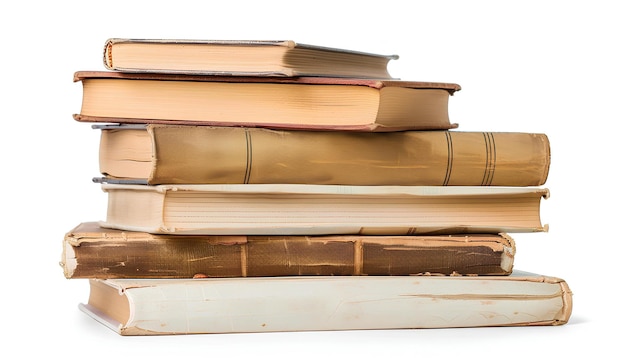
You are a GUI agent. You are given a task and a screenshot of the screen. Output one action in this format:
    pyautogui.click(x=<x>, y=<y>)
    Task: Click on the books
    This screenshot has height=358, width=626.
    Given the screenshot: What is the action you would take?
    pyautogui.click(x=295, y=309), pyautogui.click(x=292, y=257), pyautogui.click(x=298, y=202), pyautogui.click(x=300, y=157), pyautogui.click(x=300, y=103), pyautogui.click(x=265, y=61)